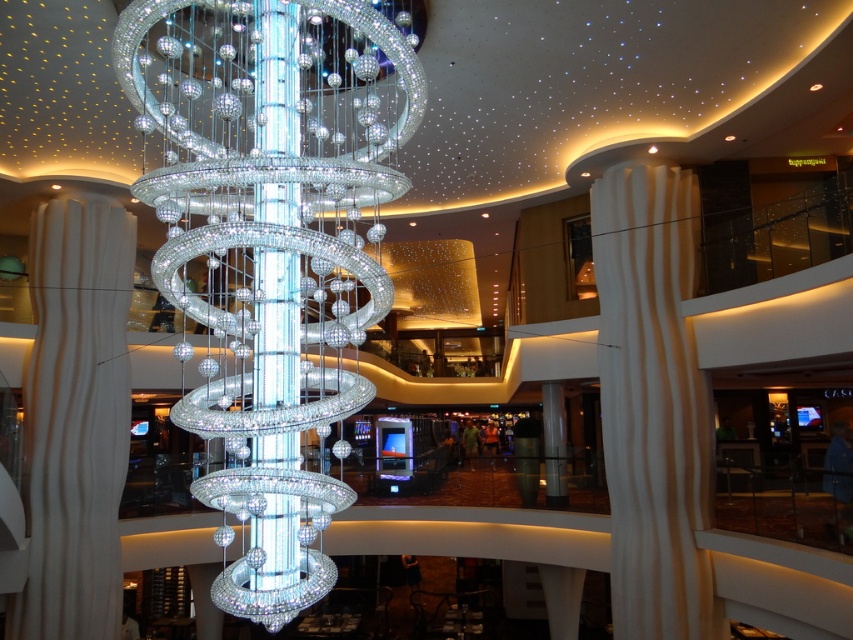
You are an interior designer planning to install a new lighting fixture in a space similar to this. You have a clear crystal chandelier at center and a white textured column at center. Considering their heights, which object should you adjust to ensure the chandelier does not obstruct the main walkway?

The clear crystal chandelier at center has a lesser height compared to the white textured column at center. To ensure the chandelier does not obstruct the main walkway, you should adjust the height of the clear crystal chandelier at center to be lower or the column to be taller, ensuring sufficient clearance.

You are standing in the lobby and want to take a photo of the clear crystal chandelier at center and the white textured column at center. If you position yourself so that the column is on your right side, which object should be on your left side?

The clear crystal chandelier at center is to the left of the white textured column at center, so if the column is on your right side, the clear crystal chandelier at center would be on your left side.

You are standing in the lobby and want to take a photo of the clear crystal chandelier at center. The chandelier is marked by point (271, 246). Where should you position yourself to ensure the chandelier is centered in your photo?

Position yourself directly in front of the clear crystal chandelier at center, which is located at point (271, 246), to ensure it is centered in your photo.